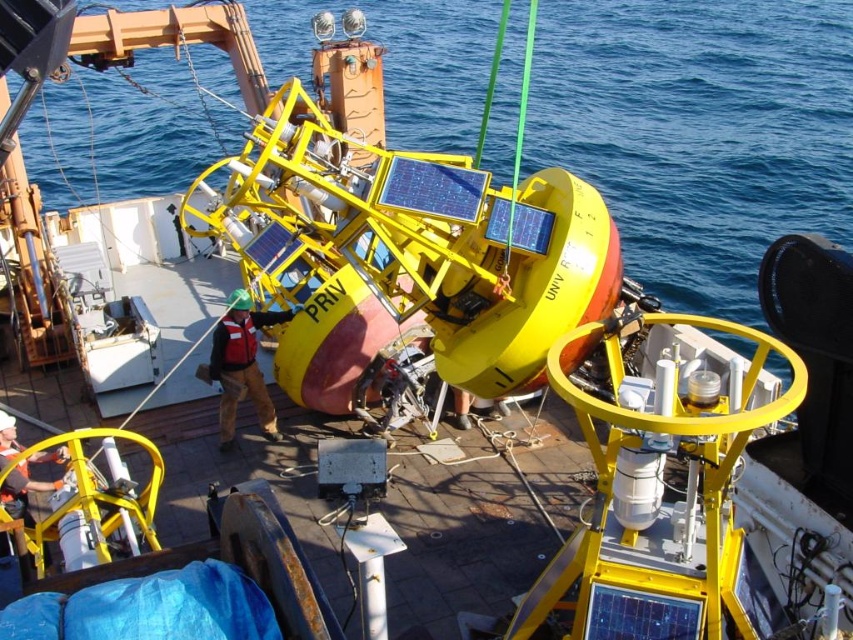
Between hard hat helmet at center and brushed metal helmet at lower left, which one appears on the right side from the viewer's perspective?

hard hat helmet at center

Measure the distance between hard hat helmet at center and camera.

The distance of hard hat helmet at center from camera is 29.88 feet.

This screenshot has width=853, height=640. Describe the element at coordinates (241, 364) in the screenshot. I see `hard hat helmet at center` at that location.

Find the location of a particular element. The width and height of the screenshot is (853, 640). hard hat helmet at center is located at coordinates (241, 364).